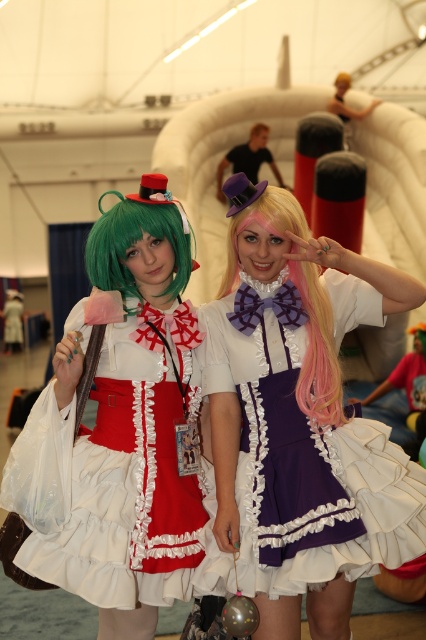
You are standing in the convention hall and see the pink silky wig at center. Can you tell me where the point at coordinates (316, 349) is located?

The point at coordinates (316, 349) is located on the pink silky wig at center.

You are a photographer at the event and want to capture both the purple satin dress at center and the matte white dress at center in a single frame. Which dress should you position closer to the left side of the camera to ensure both are visible?

To ensure both the purple satin dress at center and the matte white dress at center are visible, position the matte white dress at center closer to the left side of the camera since the purple satin dress at center is already to its right.